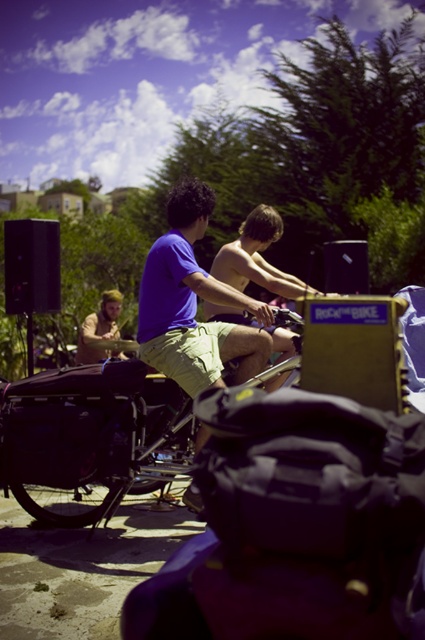
Question: Which is nearer to the matte black bicycle at center?

Choices:
 (A) smooth skin boy at center
 (B) purple cotton shirt at center
 (C) light brown hair at center

Answer: (B)

Question: Which object appears farthest from the camera in this image?

Choices:
 (A) matte black bicycle at center
 (B) smooth skin boy at center
 (C) purple cotton shirt at center

Answer: (B)

Question: Which of the following is the farthest from the observer?

Choices:
 (A) (266, 205)
 (B) (147, 465)

Answer: (A)

Question: Is matte black bicycle at center smaller than purple cotton shirt at center?

Choices:
 (A) no
 (B) yes

Answer: (A)

Question: Does matte black bicycle at center have a larger size compared to smooth skin boy at center?

Choices:
 (A) no
 (B) yes

Answer: (B)

Question: From the image, what is the correct spatial relationship of matte black bicycle at center in relation to smooth skin boy at center?

Choices:
 (A) left
 (B) right

Answer: (A)